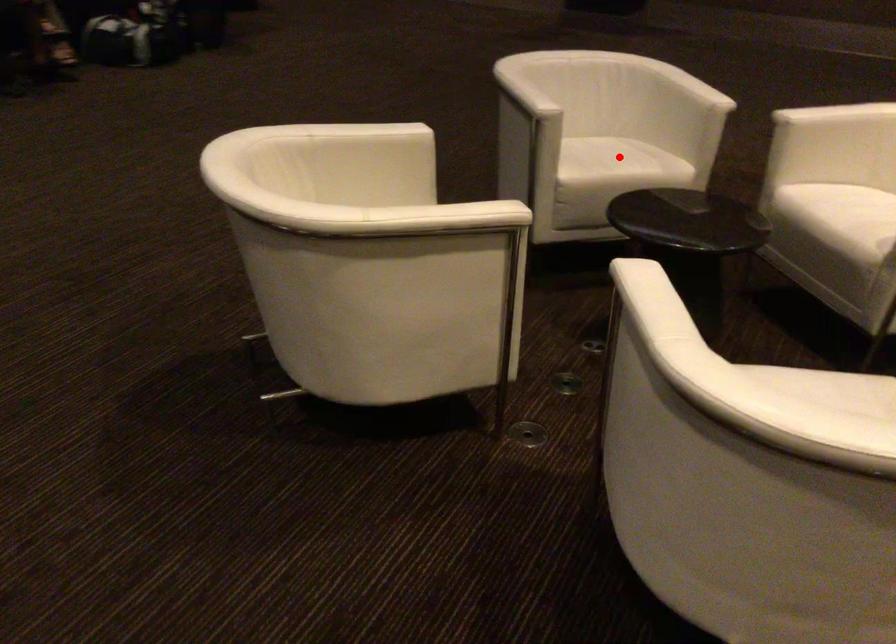
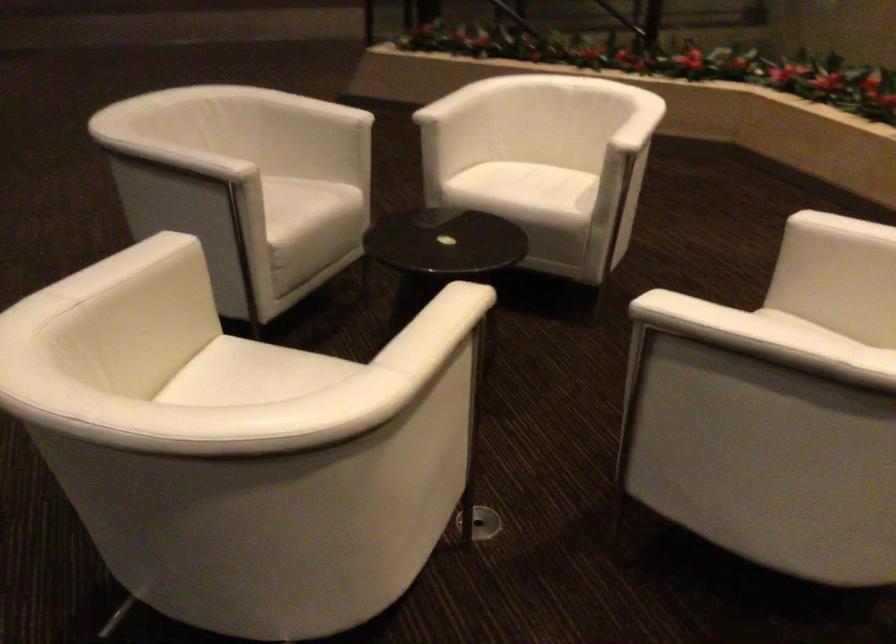
Question: I am providing you with two images of the same scene from different viewpoints. Given a red point in image1, look at the same physical point in image2. Is it:

Choices:
 (A) Closer to the viewpoint
 (B) Farther from the viewpoint

Answer: (A)